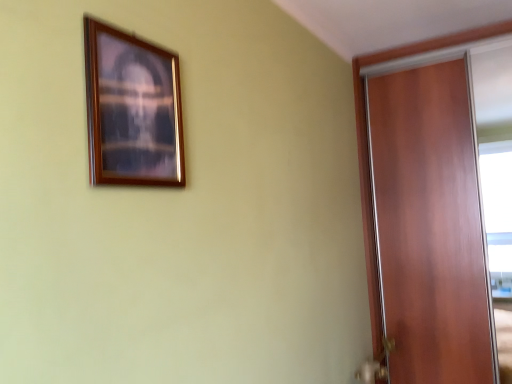
Measure the distance between wooden door at right and camera.

wooden door at right is 7.35 feet from camera.

What do you see at coordinates (375, 365) in the screenshot? I see `gold metallic door handle at lower right` at bounding box center [375, 365].

The height and width of the screenshot is (384, 512). I want to click on wooden door at right, so tap(430, 226).

Consider the image. From the image's perspective, is wooden picture frame at upper left under wooden door at right?

No.

From a real-world perspective, which object rests below the other?

From a 3D spatial view, wooden door at right is below.

Identify the location of door below the wooden picture frame at upper left (from a real-world perspective). This screenshot has width=512, height=384. (430, 226).

Who is more distant, wooden picture frame at upper left or wooden door at right?

wooden door at right is more distant.

What's the angular difference between wooden door at right and wooden picture frame at upper left's facing directions?

90.2 degrees.

From a real-world perspective, is wooden door at right physically located above or below wooden picture frame at upper left?

In terms of real-world spatial position, wooden door at right is below wooden picture frame at upper left.

Are wooden door at right and wooden picture frame at upper left beside each other?

No, wooden door at right is not in contact with wooden picture frame at upper left.

Locate an element on the screen. The width and height of the screenshot is (512, 384). door located below the wooden picture frame at upper left (from the image's perspective) is located at coordinates (430, 226).

Is wooden picture frame at upper left situated inside gold metallic door handle at lower right or outside?

wooden picture frame at upper left is not enclosed by gold metallic door handle at lower right.

Is wooden picture frame at upper left aimed at gold metallic door handle at lower right?

No, wooden picture frame at upper left is not oriented towards gold metallic door handle at lower right.

From a real-world perspective, which is physically above, wooden picture frame at upper left or gold metallic door handle at lower right?

In real-world perspective, wooden picture frame at upper left is above.

Does wooden door at right come in front of gold metallic door handle at lower right?

No, the depth of wooden door at right is greater than that of gold metallic door handle at lower right.

From a real-world perspective, between wooden door at right and gold metallic door handle at lower right, who is vertically higher?

From a 3D spatial view, wooden door at right is above.

Based on the photo, how different are the orientations of wooden door at right and gold metallic door handle at lower right in degrees?

wooden door at right and gold metallic door handle at lower right are facing 89.3 degrees away from each other.

Considering the relative sizes of wooden door at right and gold metallic door handle at lower right in the image provided, is wooden door at right smaller than gold metallic door handle at lower right?

Incorrect, wooden door at right is not smaller in size than gold metallic door handle at lower right.

Consider the image. Can you confirm if gold metallic door handle at lower right is taller than wooden door at right?

No.

Which is in front, gold metallic door handle at lower right or wooden door at right?

gold metallic door handle at lower right is in front.

How different are the orientations of gold metallic door handle at lower right and wooden door at right in degrees?

89.3 degrees.

From a real-world perspective, is gold metallic door handle at lower right above or below wooden door at right?

gold metallic door handle at lower right is below wooden door at right.

Which is more to the right, gold metallic door handle at lower right or wooden picture frame at upper left?

From the viewer's perspective, gold metallic door handle at lower right appears more on the right side.

Are gold metallic door handle at lower right and wooden picture frame at upper left far apart?

Yes, gold metallic door handle at lower right and wooden picture frame at upper left are located far from each other.

Does gold metallic door handle at lower right have a greater height compared to wooden picture frame at upper left?

No.

From the picture: From the image's perspective, which one is positioned lower, gold metallic door handle at lower right or wooden picture frame at upper left?

From the image's view, gold metallic door handle at lower right is below.

I want to click on picture frame on the left side of wooden door at right, so click(132, 109).

At what (x,y) coordinates should I click in order to perform the action: click on door behind the wooden picture frame at upper left. Please return your answer as a coordinate pair (x, y). Looking at the image, I should click on tap(430, 226).

Estimate the real-world distances between objects in this image. Which object is closer to wooden picture frame at upper left, wooden door at right or gold metallic door handle at lower right?

Among the two, gold metallic door handle at lower right is located nearer to wooden picture frame at upper left.

Based on their spatial positions, is wooden picture frame at upper left or gold metallic door handle at lower right further from wooden door at right?

wooden picture frame at upper left.

Estimate the real-world distances between objects in this image. Which object is further from gold metallic door handle at lower right, wooden door at right or wooden picture frame at upper left?

Among the two, wooden picture frame at upper left is located further to gold metallic door handle at lower right.

From the image, which object appears to be farther from wooden picture frame at upper left, gold metallic door handle at lower right or wooden door at right?

wooden door at right is further to wooden picture frame at upper left.

Considering their positions, is gold metallic door handle at lower right positioned further to wooden door at right than wooden picture frame at upper left?

wooden picture frame at upper left lies further to wooden door at right than the other object.

Looking at the image, which one is located further to gold metallic door handle at lower right, wooden picture frame at upper left or wooden door at right?

wooden picture frame at upper left is further to gold metallic door handle at lower right.

Locate an element on the screen. The width and height of the screenshot is (512, 384). door handle between wooden picture frame at upper left and wooden door at right is located at coordinates (x=375, y=365).